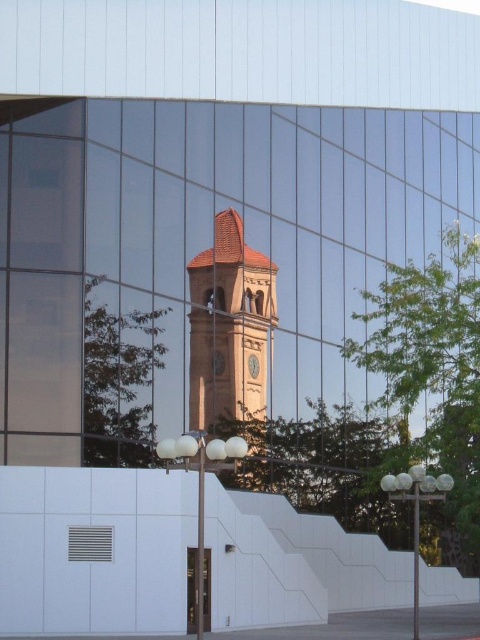
From the picture: Does brown textured clock tower at center have a smaller size compared to transparent glass door at lower center?

No.

Who is higher up, brown textured clock tower at center or transparent glass door at lower center?

brown textured clock tower at center is above.

Is point (195, 262) farther from viewer compared to point (208, 573)?

That is True.

The image size is (480, 640). Identify the location of brown textured clock tower at center. (232, 342).

From the picture: Can you confirm if green leafy tree at right is positioned to the right of brown textured clock tower at center?

Yes, green leafy tree at right is to the right of brown textured clock tower at center.

The width and height of the screenshot is (480, 640). Describe the element at coordinates (432, 378) in the screenshot. I see `green leafy tree at right` at that location.

Which is in front, point (407, 422) or point (244, 269)?

Positioned in front is point (244, 269).

Find the location of a particular element. This screenshot has width=480, height=640. green leafy tree at right is located at coordinates (432, 378).

Is green leafy tree at right wider than transparent glass door at lower center?

Indeed, green leafy tree at right has a greater width compared to transparent glass door at lower center.

Which is behind, point (478, 516) or point (192, 602)?

The point (478, 516) is more distant.

Does point (444, 355) lie in front of point (194, 593)?

No, (444, 355) is further to viewer.

The width and height of the screenshot is (480, 640). In order to click on green leafy tree at right in this screenshot , I will do `click(432, 378)`.